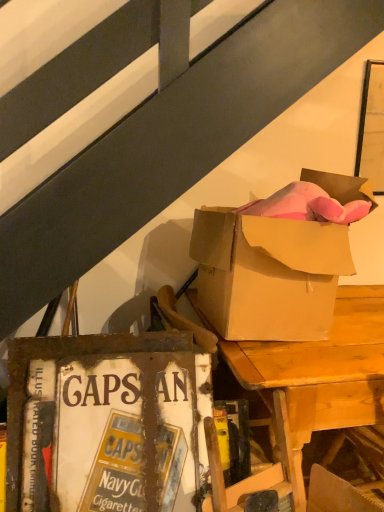
Question: Is matte cardboard box at upper right thinner than wooden desk at upper right?

Choices:
 (A) no
 (B) yes

Answer: (B)

Question: Is matte cardboard box at upper right outside wooden desk at upper right?

Choices:
 (A) no
 (B) yes

Answer: (B)

Question: From the image's perspective, does matte cardboard box at upper right appear higher than wooden desk at upper right?

Choices:
 (A) yes
 (B) no

Answer: (A)

Question: Would you say matte cardboard box at upper right is a long distance from wooden desk at upper right?

Choices:
 (A) no
 (B) yes

Answer: (A)

Question: Does matte cardboard box at upper right have a lesser height compared to wooden desk at upper right?

Choices:
 (A) yes
 (B) no

Answer: (A)

Question: Based on their positions, is rusty metal sign at lower left located to the left or right of wooden desk at upper right?

Choices:
 (A) right
 (B) left

Answer: (B)

Question: Looking at their shapes, would you say rusty metal sign at lower left is wider or thinner than wooden desk at upper right?

Choices:
 (A) thin
 (B) wide

Answer: (A)

Question: Is rusty metal sign at lower left taller or shorter than wooden desk at upper right?

Choices:
 (A) tall
 (B) short

Answer: (B)

Question: In terms of size, does rusty metal sign at lower left appear bigger or smaller than wooden desk at upper right?

Choices:
 (A) big
 (B) small

Answer: (B)

Question: Is point (271, 330) positioned closer to the camera than point (185, 467)?

Choices:
 (A) closer
 (B) farther

Answer: (B)

Question: Based on their sizes in the image, would you say matte cardboard box at upper right is bigger or smaller than rusty metal sign at lower left?

Choices:
 (A) small
 (B) big

Answer: (B)

Question: Is matte cardboard box at upper right spatially inside rusty metal sign at lower left, or outside of it?

Choices:
 (A) outside
 (B) inside

Answer: (A)

Question: Relative to rusty metal sign at lower left, is matte cardboard box at upper right in front or behind?

Choices:
 (A) behind
 (B) front

Answer: (A)

Question: Which is correct: wooden desk at upper right is inside rusty metal sign at lower left, or outside of it?

Choices:
 (A) outside
 (B) inside

Answer: (A)

Question: In terms of width, does wooden desk at upper right look wider or thinner when compared to rusty metal sign at lower left?

Choices:
 (A) thin
 (B) wide

Answer: (B)